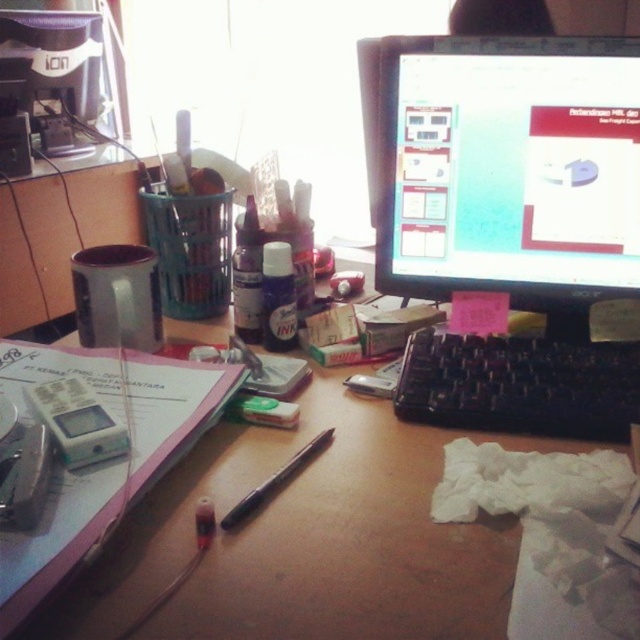
Question: Which of the following is the closest to the observer?

Choices:
 (A) (324, 440)
 (B) (104, 449)

Answer: (B)

Question: Which object is the farthest from the matte black pen at center?

Choices:
 (A) white plastic calculator at left
 (B) pink paper notebook at lower left
 (C) wooden desk at center

Answer: (B)

Question: Among these objects, which one is nearest to the camera?

Choices:
 (A) wooden desk at center
 (B) pink paper notebook at lower left
 (C) black plastic keyboard at center
 (D) white plastic calculator at left

Answer: (B)

Question: Is black plastic keyboard at center smaller than white plastic calculator at left?

Choices:
 (A) yes
 (B) no

Answer: (B)

Question: Does wooden desk at center appear under black plastic keyboard at center?

Choices:
 (A) no
 (B) yes

Answer: (B)

Question: Is wooden desk at center bigger than white plastic calculator at left?

Choices:
 (A) yes
 (B) no

Answer: (A)